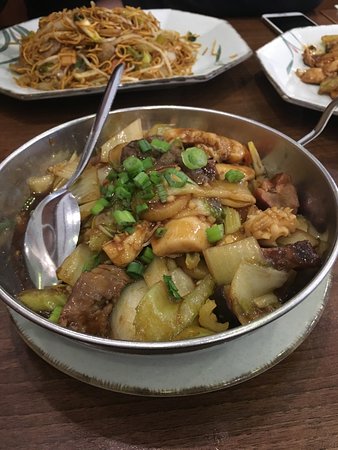
In order to click on plate in this screenshot , I will do `click(226, 38)`.